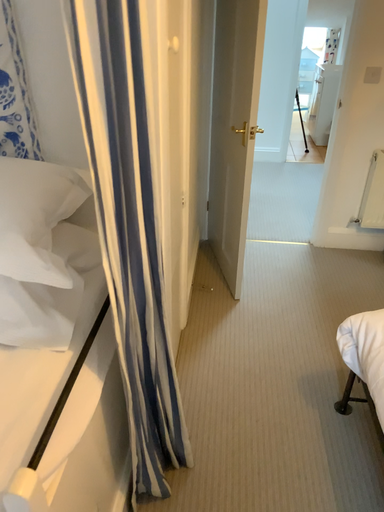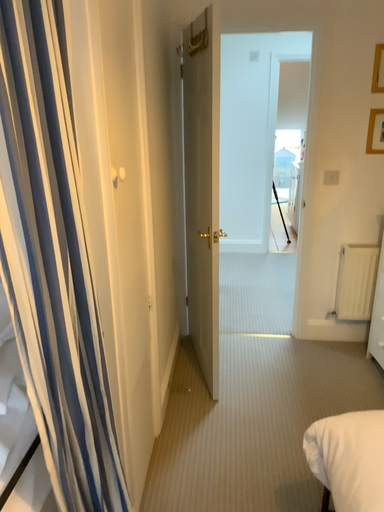
Question: Which way did the camera rotate in the video?

Choices:
 (A) rotated upward
 (B) rotated downward

Answer: (A)